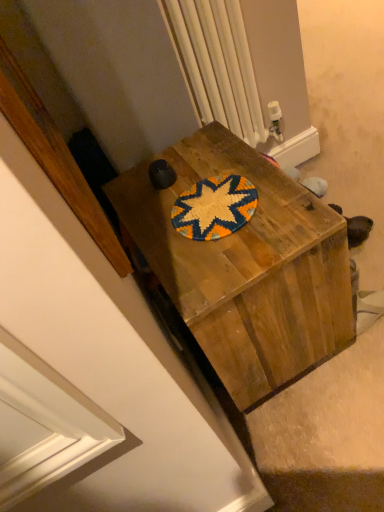
This screenshot has height=512, width=384. I want to click on blank space situated above wooden desk at center (from a real-world perspective), so click(x=205, y=203).